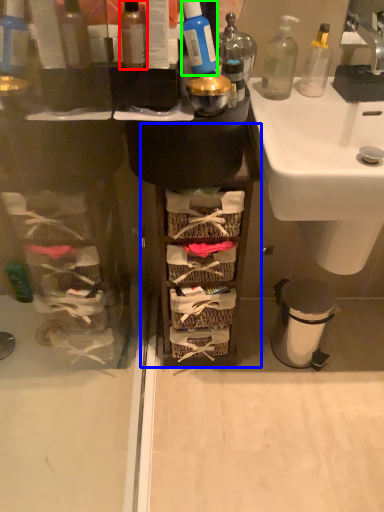
Question: Which is farther away from bottle (highlighted by a red box)? cabinetry (highlighted by a blue box) or cleaning product (highlighted by a green box)?

Choices:
 (A) cabinetry
 (B) cleaning product

Answer: (A)